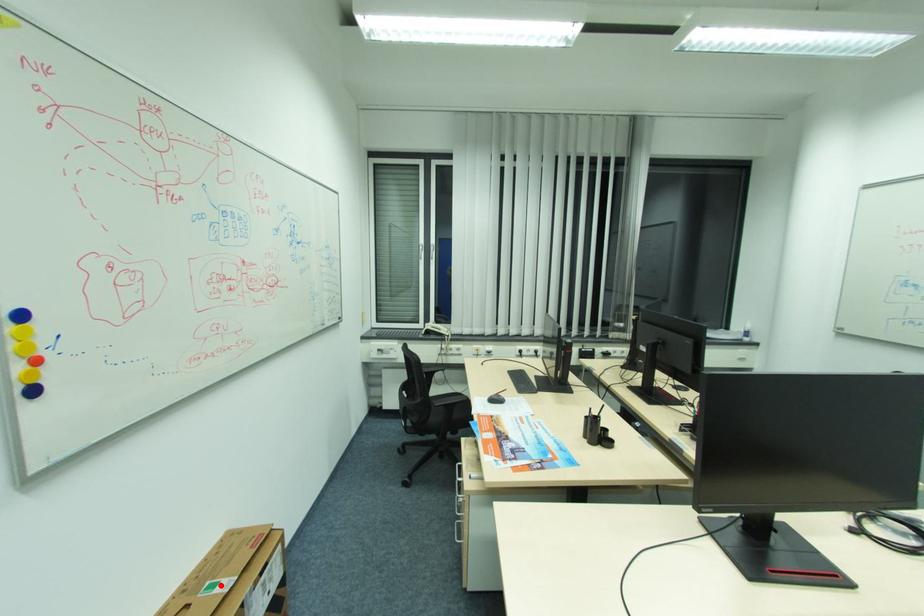
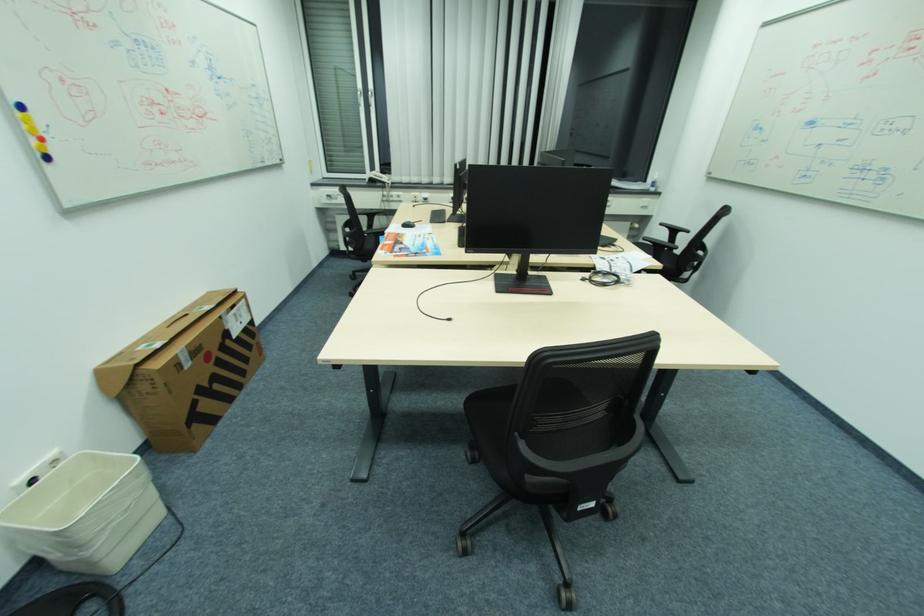
Find the pixel in the second image that matches the highlighted location in the first image.

(207, 308)